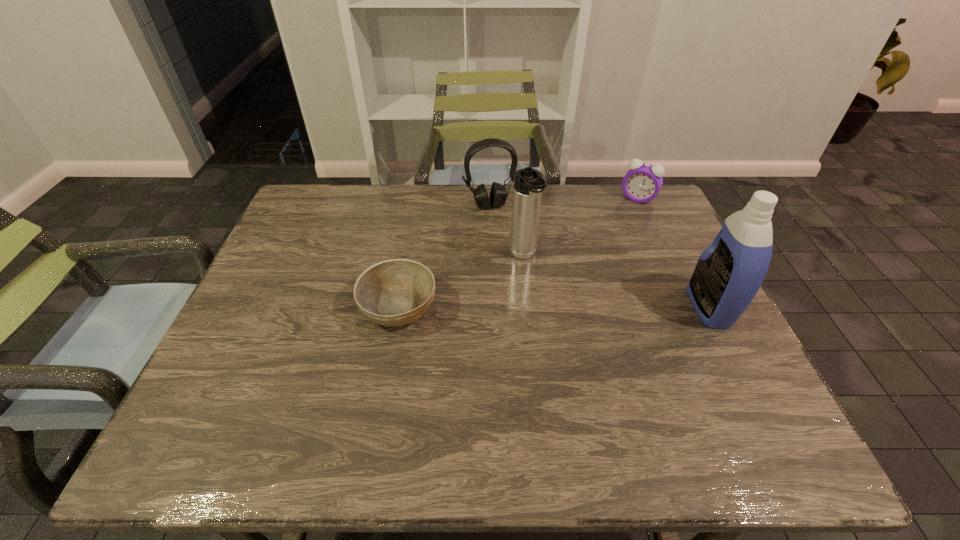
The width and height of the screenshot is (960, 540). Find the location of `vacant area situated 0.210m on the face of the second shortest object`. vacant area situated 0.210m on the face of the second shortest object is located at coordinates (611, 242).

This screenshot has height=540, width=960. I want to click on free space located on the face of the second shortest object, so click(x=612, y=239).

The image size is (960, 540). I want to click on free location located 0.260m on the front-facing side of the headset, so click(512, 267).

Locate an element on the screen. The height and width of the screenshot is (540, 960). vacant space located on the front-facing side of the headset is located at coordinates (521, 299).

You are a GUI agent. You are given a task and a screenshot of the screen. Output one action in this format:
    pyautogui.click(x=<x>, y=<y>)
    Task: Click on the free space located on the front-facing side of the headset
    
    Given the screenshot: What is the action you would take?
    click(x=508, y=253)

You are a GUI agent. You are given a task and a screenshot of the screen. Output one action in this format:
    pyautogui.click(x=<x>, y=<y>)
    Task: Click on the free spot located on the handle side of the third farthest object
    Image resolution: width=960 pixels, height=540 pixels.
    Given the screenshot: What is the action you would take?
    pyautogui.click(x=581, y=371)

Find the location of a particular element. The height and width of the screenshot is (540, 960). free space located on the handle side of the third farthest object is located at coordinates (577, 364).

The width and height of the screenshot is (960, 540). I want to click on vacant area situated 0.390m on the handle side of the third farthest object, so click(590, 390).

Where is `alarm clock present at the far edge`? The width and height of the screenshot is (960, 540). alarm clock present at the far edge is located at coordinates (643, 181).

Locate an element on the screen. This screenshot has width=960, height=540. headset that is positioned at the far edge is located at coordinates (498, 194).